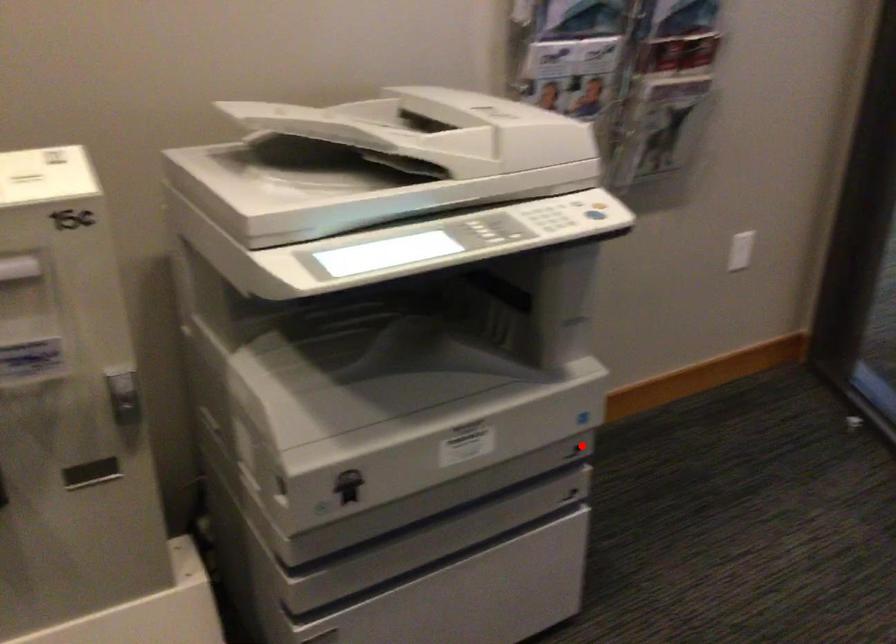
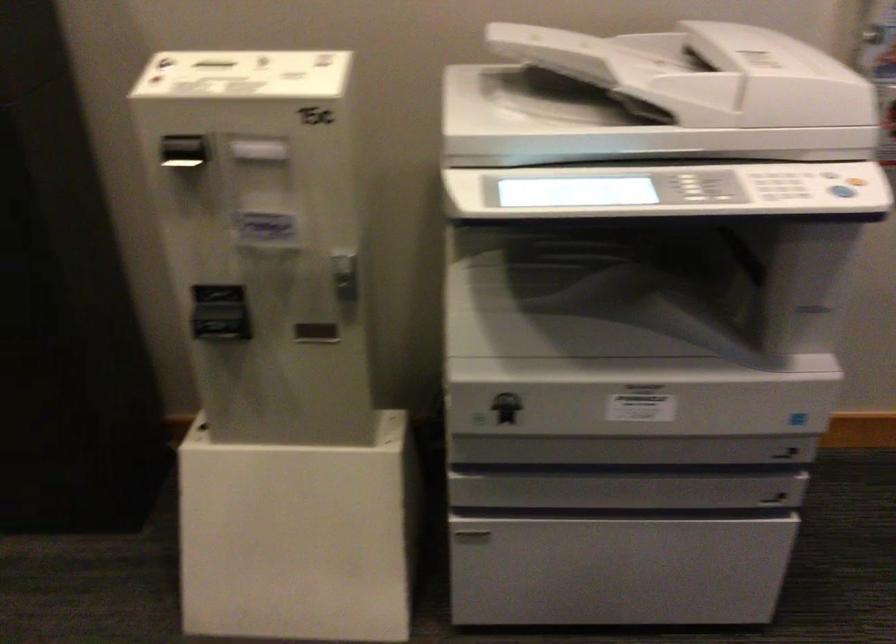
Locate, in the second image, the point that corresponds to the highlighted location in the first image.

(790, 449)